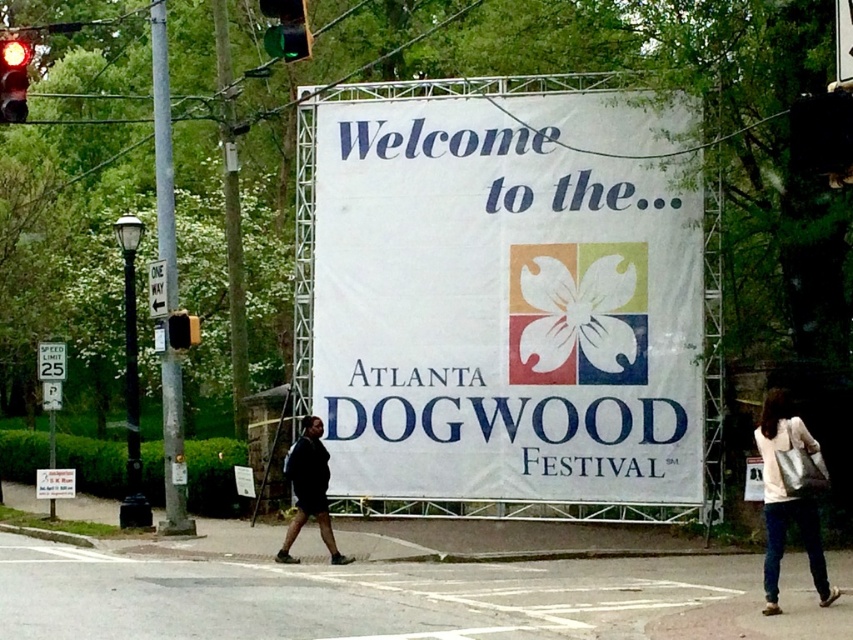
Question: Which of the following is the closest to the observer?

Choices:
 (A) coord(263,3)
 (B) coord(61,346)
 (C) coord(303,513)

Answer: (A)

Question: Among these objects, which one is nearest to the camera?

Choices:
 (A) white fabric banner at center
 (B) yellow plastic traffic light at left
 (C) white leather bag at lower right
 (D) green plastic one way sign at upper center

Answer: (C)

Question: Which point appears closest to the camera in this image?

Choices:
 (A) (6, 72)
 (B) (798, 515)
 (C) (288, 52)
 (D) (305, 424)

Answer: (B)

Question: Is white leather bag at lower right smaller than red glass traffic light at upper left?

Choices:
 (A) no
 (B) yes

Answer: (A)

Question: Does white fabric banner at center have a smaller size compared to yellow plastic traffic light at left?

Choices:
 (A) no
 (B) yes

Answer: (A)

Question: Can you confirm if white leather bag at lower right is bigger than green plastic one way sign at upper center?

Choices:
 (A) no
 (B) yes

Answer: (B)